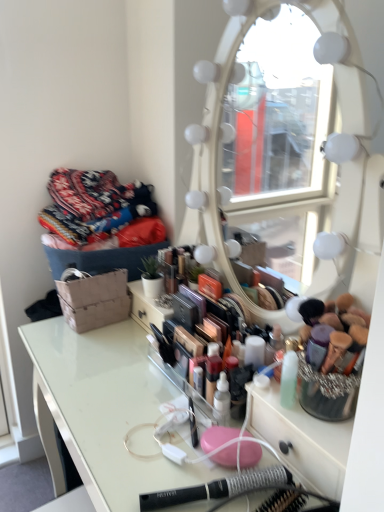
The width and height of the screenshot is (384, 512). What do you see at coordinates (216, 488) in the screenshot? I see `black plastic hairbrush at lower center` at bounding box center [216, 488].

Locate an element on the screen. This screenshot has height=512, width=384. clear acrylic table at center is located at coordinates (106, 408).

Find the location of a particular element. This screenshot has height=512, width=384. knitted fabric pile at upper left is located at coordinates (99, 212).

What's the angular difference between clear acrylic table at center and black plastic hairbrush at lower center's facing directions?

There is a 21.3-degree angle between the facing directions of clear acrylic table at center and black plastic hairbrush at lower center.

Does clear acrylic table at center come behind black plastic hairbrush at lower center?

No, it is in front of black plastic hairbrush at lower center.

Are clear acrylic table at center and black plastic hairbrush at lower center making contact?

No, clear acrylic table at center is not beside black plastic hairbrush at lower center.

Which of these two, black plastic hairbrush at lower center or knitted fabric pile at upper left, stands taller?

Standing taller between the two is knitted fabric pile at upper left.

Can you confirm if black plastic hairbrush at lower center is wider than knitted fabric pile at upper left?

No, black plastic hairbrush at lower center is not wider than knitted fabric pile at upper left.

Which object is positioned more to the right, black plastic hairbrush at lower center or knitted fabric pile at upper left?

Positioned to the right is black plastic hairbrush at lower center.

Where is `equipment lying in front of the knitted fabric pile at upper left`? This screenshot has width=384, height=512. equipment lying in front of the knitted fabric pile at upper left is located at coordinates (216, 488).

Considering the sizes of clear acrylic table at center and knitted fabric pile at upper left in the image, is clear acrylic table at center bigger or smaller than knitted fabric pile at upper left?

Clearly, clear acrylic table at center is larger in size than knitted fabric pile at upper left.

In the image, is clear acrylic table at center on the left side or the right side of knitted fabric pile at upper left?

Clearly, clear acrylic table at center is on the right of knitted fabric pile at upper left in the image.

Considering the positions of objects clear acrylic table at center and knitted fabric pile at upper left in the image provided, who is behind, clear acrylic table at center or knitted fabric pile at upper left?

knitted fabric pile at upper left is further from the camera.

Which object is closer to the camera, knitted fabric pile at upper left or clear acrylic table at center?

Positioned in front is clear acrylic table at center.

Who is taller, knitted fabric pile at upper left or clear acrylic table at center?

With more height is clear acrylic table at center.

From the image's perspective, is knitted fabric pile at upper left located beneath clear acrylic table at center?

No, from the image's perspective, knitted fabric pile at upper left is not below clear acrylic table at center.

Is clear acrylic table at center located within knitted fabric pile at upper left?

No, clear acrylic table at center is located outside of knitted fabric pile at upper left.

Is knitted fabric pile at upper left not within black plastic hairbrush at lower center?

Indeed, knitted fabric pile at upper left is completely outside black plastic hairbrush at lower center.

Which object is positioned more to the right, knitted fabric pile at upper left or black plastic hairbrush at lower center?

black plastic hairbrush at lower center.

From the picture: Which object is closer to the camera, knitted fabric pile at upper left or black plastic hairbrush at lower center?

black plastic hairbrush at lower center is closer to the camera.

Who is shorter, knitted fabric pile at upper left or black plastic hairbrush at lower center?

With less height is black plastic hairbrush at lower center.

From the image's perspective, which object appears higher, black plastic hairbrush at lower center or clear acrylic table at center?

black plastic hairbrush at lower center.

Considering the positions of point (256, 471) and point (126, 504), is point (256, 471) closer or farther from the camera than point (126, 504)?

Clearly, point (256, 471) is more distant from the camera than point (126, 504).

From the picture: From their relative heights in the image, would you say black plastic hairbrush at lower center is taller or shorter than clear acrylic table at center?

In the image, black plastic hairbrush at lower center appears to be shorter than clear acrylic table at center.

Is the surface of black plastic hairbrush at lower center in direct contact with clear acrylic table at center?

No, black plastic hairbrush at lower center is not touching clear acrylic table at center.

Where is `table located in front of the black plastic hairbrush at lower center`? This screenshot has height=512, width=384. table located in front of the black plastic hairbrush at lower center is located at coordinates (106, 408).

In the image, there is a black plastic hairbrush at lower center. Where is `clothing above it (from the image's perspective)`? clothing above it (from the image's perspective) is located at coordinates (99, 212).

When comparing their distances from knitted fabric pile at upper left, does clear acrylic table at center or black plastic hairbrush at lower center seem further?

The object further to knitted fabric pile at upper left is black plastic hairbrush at lower center.

Looking at the image, which one is located further to clear acrylic table at center, knitted fabric pile at upper left or black plastic hairbrush at lower center?

knitted fabric pile at upper left.

Looking at the image, which one is located further to black plastic hairbrush at lower center, clear acrylic table at center or knitted fabric pile at upper left?

knitted fabric pile at upper left is positioned further to the anchor black plastic hairbrush at lower center.

Which object lies further to the anchor point knitted fabric pile at upper left, black plastic hairbrush at lower center or clear acrylic table at center?

black plastic hairbrush at lower center lies further to knitted fabric pile at upper left than the other object.

Considering their positions, is knitted fabric pile at upper left positioned further to black plastic hairbrush at lower center than clear acrylic table at center?

knitted fabric pile at upper left is positioned further to the anchor black plastic hairbrush at lower center.

When comparing their distances from clear acrylic table at center, does black plastic hairbrush at lower center or knitted fabric pile at upper left seem closer?

black plastic hairbrush at lower center lies closer to clear acrylic table at center than the other object.

Locate an element on the screen. The image size is (384, 512). equipment between knitted fabric pile at upper left and clear acrylic table at center in the up-down direction is located at coordinates (216, 488).